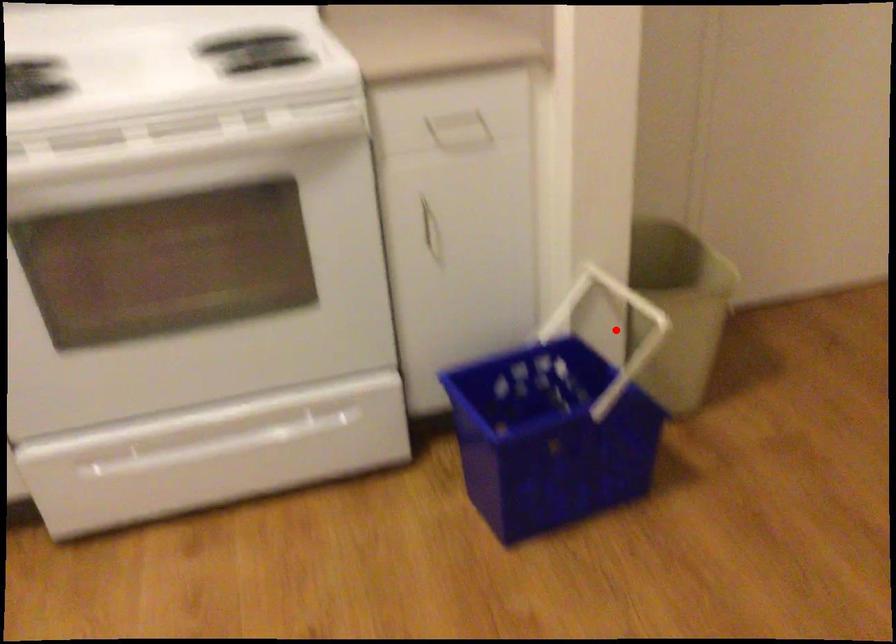
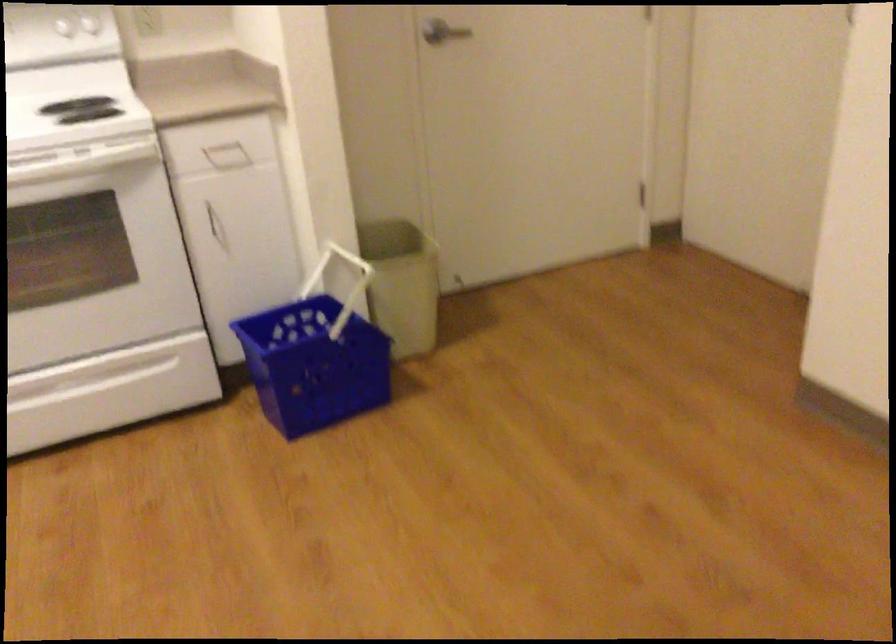
Question: I am providing you with two images of the same scene from different viewpoints. A red point is marked on the first image. Can you still see the location of the red point in image 2?

Choices:
 (A) Yes
 (B) No

Answer: (B)